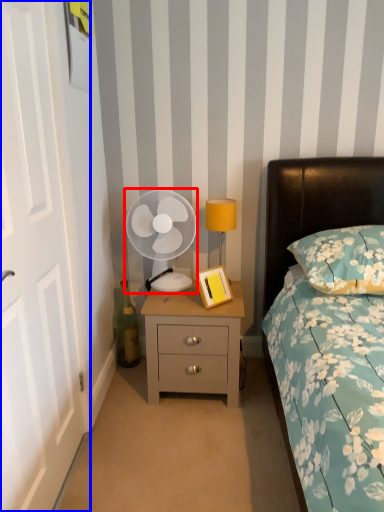
Question: Which object is further to the camera taking this photo, mechanical fan (highlighted by a red box) or door (highlighted by a blue box)?

Choices:
 (A) mechanical fan
 (B) door

Answer: (A)